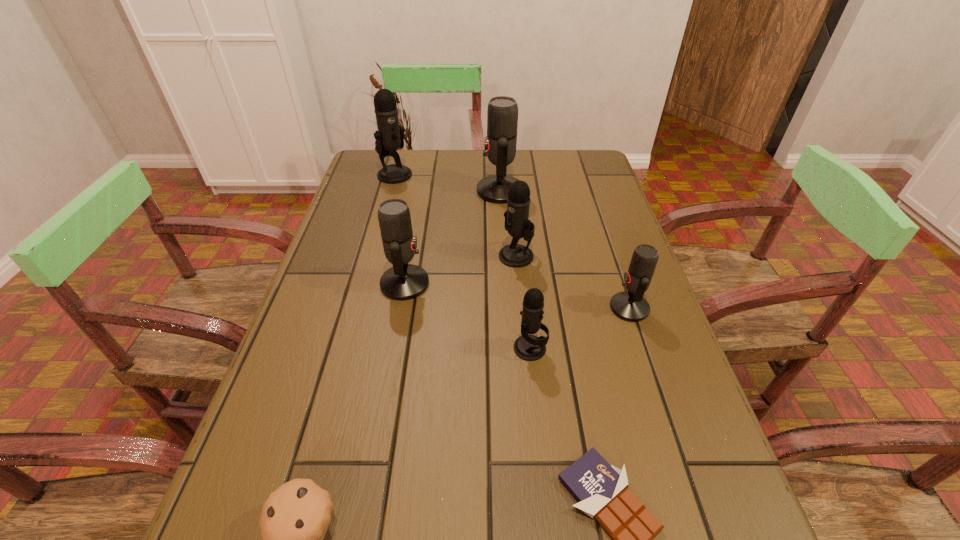
Find the location of a particular element. free region located on the side of the farthest red microphone with the red ring is located at coordinates (430, 191).

Image resolution: width=960 pixels, height=540 pixels. In order to click on vacant point located on the side of the farthest red microphone with the red ring in this screenshot , I will do `click(446, 191)`.

You are a GUI agent. You are given a task and a screenshot of the screen. Output one action in this format:
    pyautogui.click(x=<x>, y=<y>)
    Task: Click on the vacant region located on the side of the farthest red microphone with the red ring
    Image resolution: width=960 pixels, height=540 pixels.
    Given the screenshot: What is the action you would take?
    pyautogui.click(x=420, y=191)

Locate an element on the screen. The width and height of the screenshot is (960, 540). free space located 0.230m on the front of the leftmost black microphone is located at coordinates (380, 229).

Identify the location of vacant space located on the side of the second biggest red microphone with the red ring. The width and height of the screenshot is (960, 540). (578, 284).

You are a GUI agent. You are given a task and a screenshot of the screen. Output one action in this format:
    pyautogui.click(x=<x>, y=<y>)
    Task: Click on the free space located 0.060m on the back of the second smallest black microphone
    Image resolution: width=960 pixels, height=540 pixels.
    Given the screenshot: What is the action you would take?
    pyautogui.click(x=514, y=231)

The image size is (960, 540). Find the location of `vacant space located on the side of the rightmost microphone with the red ring`. vacant space located on the side of the rightmost microphone with the red ring is located at coordinates (489, 308).

At what (x,y) coordinates should I click in order to perform the action: click on vacant space located on the side of the rightmost microphone with the red ring. Please return your answer as a coordinate pair (x, y). Looking at the image, I should click on (516, 308).

Image resolution: width=960 pixels, height=540 pixels. I want to click on free space located 0.380m on the side of the rightmost microphone with the red ring, so click(x=439, y=308).

What are the coordinates of `vacant space located 0.320m on the left of the nearest microphone` in the screenshot? It's located at (356, 348).